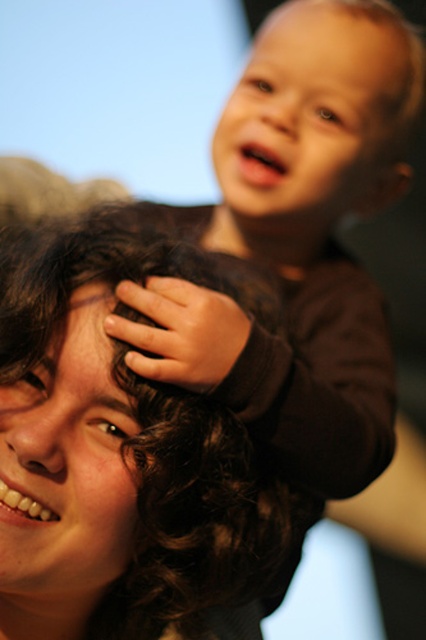
Question: Is dark curly hair at center further to camera compared to smooth brown hair at upper right?

Choices:
 (A) no
 (B) yes

Answer: (A)

Question: Can you confirm if dark curly hair at center is bigger than smooth brown hair at upper right?

Choices:
 (A) no
 (B) yes

Answer: (B)

Question: Which object is farther from the camera taking this photo?

Choices:
 (A) dark curly hair at center
 (B) smooth brown hair at upper right

Answer: (B)

Question: Which object is farther from the camera taking this photo?

Choices:
 (A) dark curly hair at center
 (B) smooth brown hair at upper right

Answer: (B)

Question: Can you confirm if dark curly hair at center is wider than smooth brown hair at upper right?

Choices:
 (A) no
 (B) yes

Answer: (B)